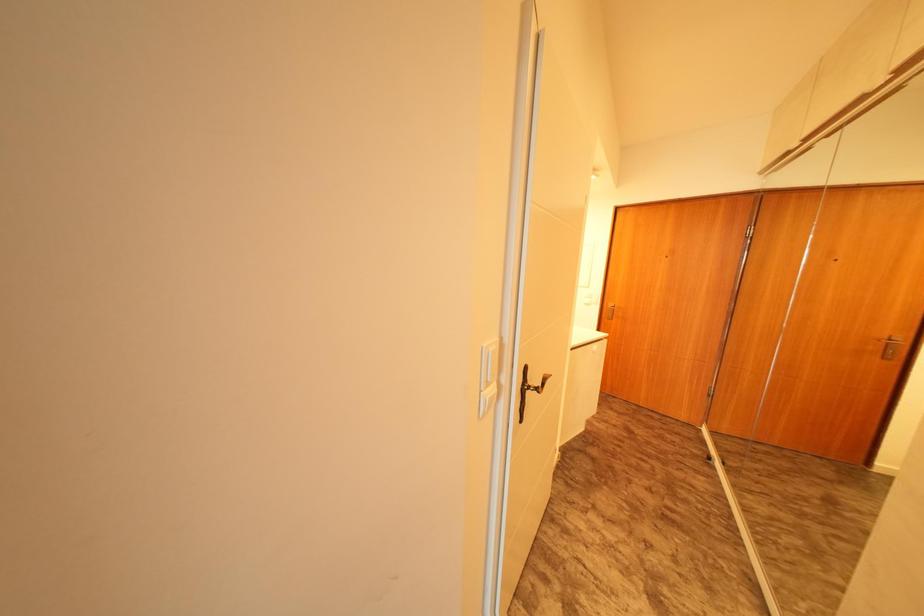
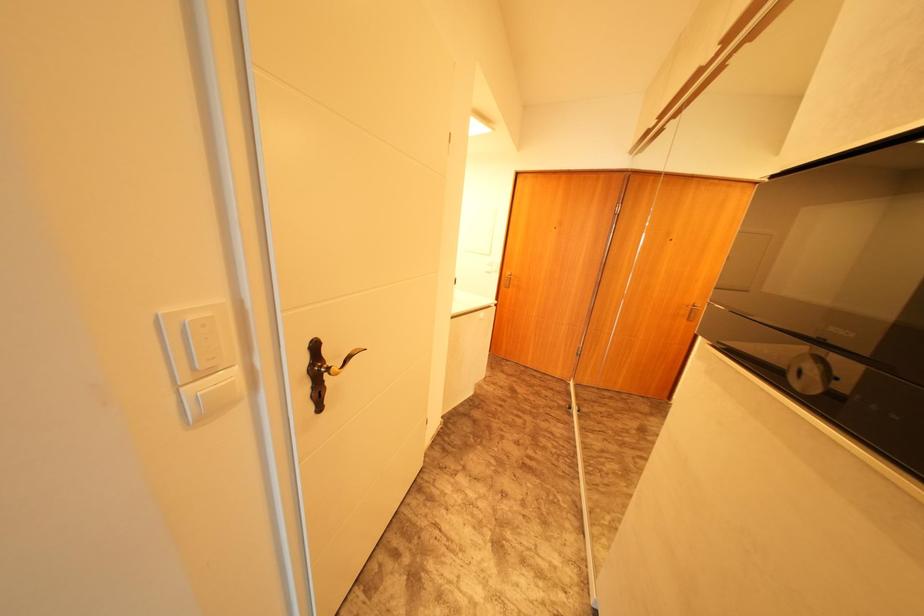
Question: The camera is either moving clockwise (left) or counter-clockwise (right) around the object. The first image is from the beginning of the video and the second image is from the end. Is the camera moving left or right when shooting the video?

Choices:
 (A) Left
 (B) Right

Answer: (A)